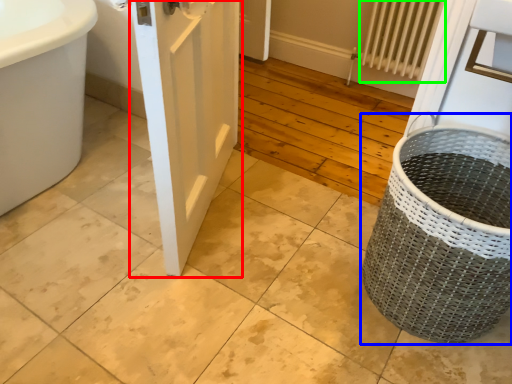
Question: Which object is the closest to the door (highlighted by a red box)? Choose among these: basket container (highlighted by a blue box) or radiator (highlighted by a green box).

Choices:
 (A) basket container
 (B) radiator

Answer: (A)